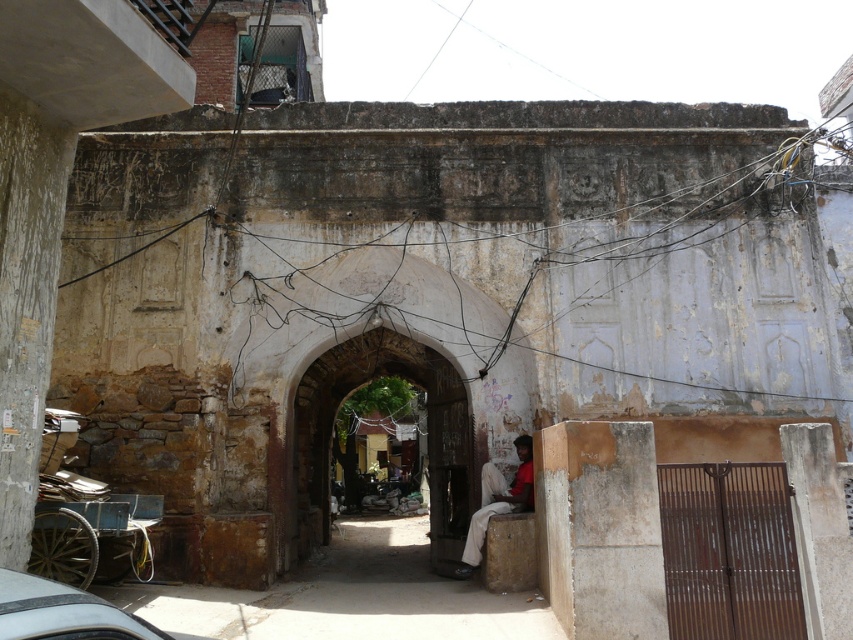
Where is `black leather car at lower left`? The image size is (853, 640). black leather car at lower left is located at coordinates (62, 612).

Between point (103, 611) and point (474, 529), which one is positioned in front?

Point (103, 611)

Locate an element on the screen. The height and width of the screenshot is (640, 853). black leather car at lower left is located at coordinates (62, 612).

Measure the distance between wooden cart at lower left and white cotton cloth at center.

The distance of wooden cart at lower left from white cotton cloth at center is 4.33 meters.

From the picture: Can you confirm if wooden cart at lower left is positioned below white cotton cloth at center?

Correct, wooden cart at lower left is located below white cotton cloth at center.

Is point (80, 570) in front of point (492, 506)?

Yes, point (80, 570) is closer to viewer.

In order to click on wooden cart at lower left in this screenshot , I will do `click(94, 538)`.

Does rustic concrete alley at center appear under wooden cart at lower left?

Correct, rustic concrete alley at center is located below wooden cart at lower left.

Where is `rustic concrete alley at center`? The width and height of the screenshot is (853, 640). rustic concrete alley at center is located at coordinates (347, 596).

You are a GUI agent. You are given a task and a screenshot of the screen. Output one action in this format:
    pyautogui.click(x=<x>, y=<y>)
    Task: Click on the rustic concrete alley at center
    The height and width of the screenshot is (640, 853).
    Given the screenshot: What is the action you would take?
    pyautogui.click(x=347, y=596)